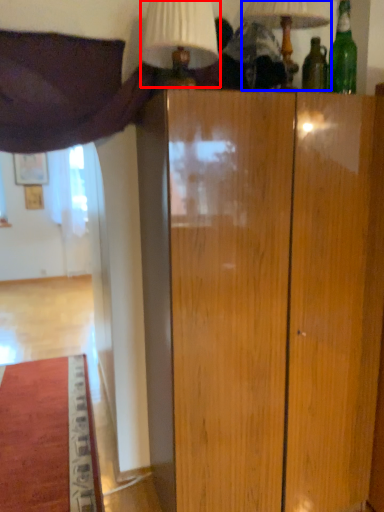
Question: Which of the following is the closest to the observer, table lamp (highlighted by a red box) or table lamp (highlighted by a blue box)?

Choices:
 (A) table lamp
 (B) table lamp

Answer: (A)